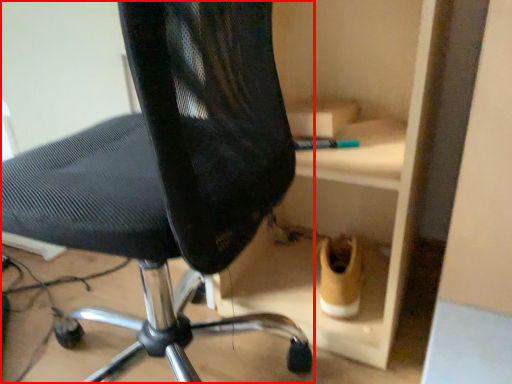
Question: From the image's perspective, what is the correct spatial relationship of chair (annotated by the red box) in relation to footwear?

Choices:
 (A) below
 (B) above

Answer: (B)